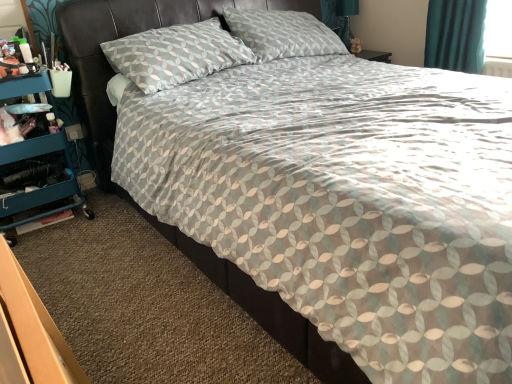
The height and width of the screenshot is (384, 512). Identify the location of vacant area on top of teal fabric curtain at upper right (from a real-world perspective). (466, 1).